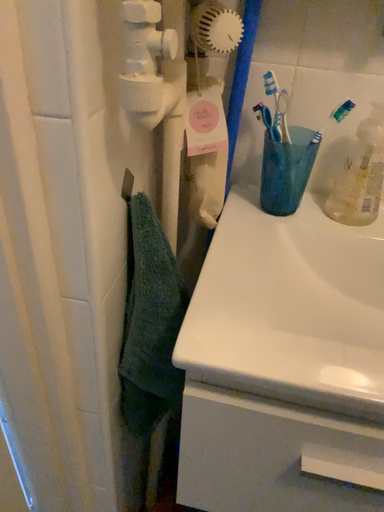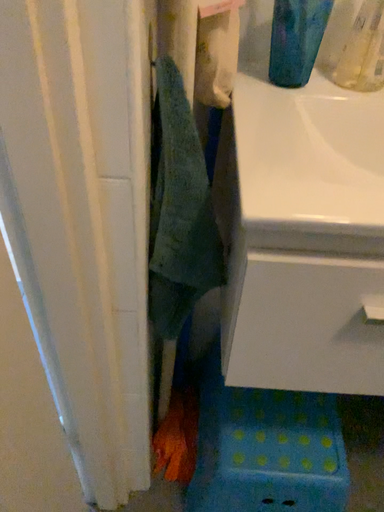
Question: How did the camera likely rotate when shooting the video?

Choices:
 (A) rotated left
 (B) rotated right

Answer: (B)